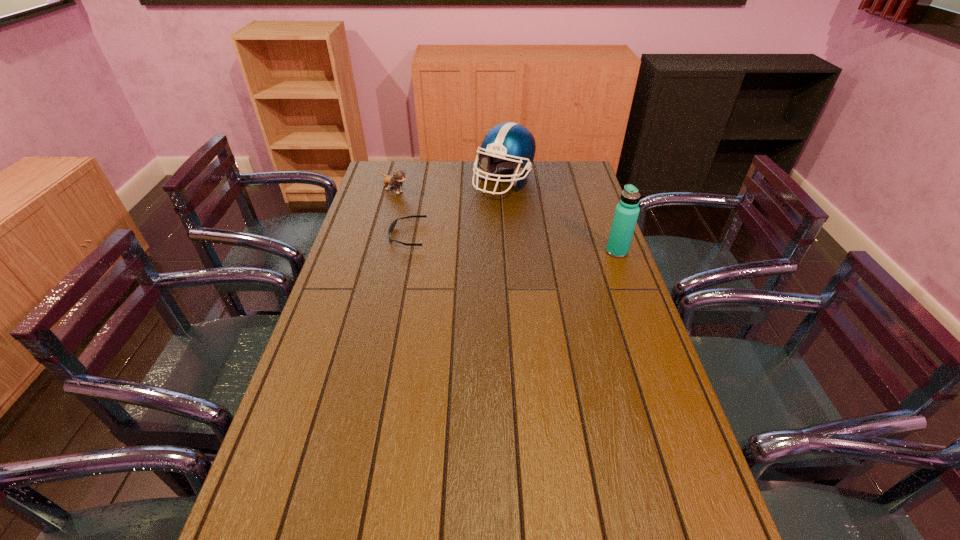
In the image, there is a desktop. At what (x,y) coordinates should I click in order to perform the action: click on vacant space at the right edge. Please return your answer as a coordinate pair (x, y). Looking at the image, I should click on (634, 429).

Locate an element on the screen. The width and height of the screenshot is (960, 540). vacant space at the far right corner of the desktop is located at coordinates (566, 161).

At what (x,y) coordinates should I click in order to perform the action: click on free space between the football helmet and the rightmost object. Please return your answer as a coordinate pair (x, y). Looking at the image, I should click on (561, 217).

Where is `vacant area between the shortest object and the football helmet`? Image resolution: width=960 pixels, height=540 pixels. vacant area between the shortest object and the football helmet is located at coordinates (455, 208).

Identify the location of free point between the third tallest object and the sunglasses. The image size is (960, 540). (400, 213).

At what (x,y) coordinates should I click in order to perform the action: click on empty space that is in between the shortest object and the football helmet. Please return your answer as a coordinate pair (x, y). The image size is (960, 540). Looking at the image, I should click on (455, 208).

You are a GUI agent. You are given a task and a screenshot of the screen. Output one action in this format:
    pyautogui.click(x=<x>, y=<y>)
    Task: Click on the free spot between the shortest object and the football helmet
    Image resolution: width=960 pixels, height=540 pixels.
    Given the screenshot: What is the action you would take?
    pyautogui.click(x=455, y=208)

You are a GUI agent. You are given a task and a screenshot of the screen. Output one action in this format:
    pyautogui.click(x=<x>, y=<y>)
    Task: Click on the free space that is in between the kitten and the sunglasses
    Image resolution: width=960 pixels, height=540 pixels.
    Given the screenshot: What is the action you would take?
    pyautogui.click(x=400, y=213)

Find the location of a particular element. The width and height of the screenshot is (960, 540). free space that is in between the third object from left to right and the sunglasses is located at coordinates (455, 208).

Find the location of `free spot between the sunglasses and the third tallest object`. free spot between the sunglasses and the third tallest object is located at coordinates (400, 213).